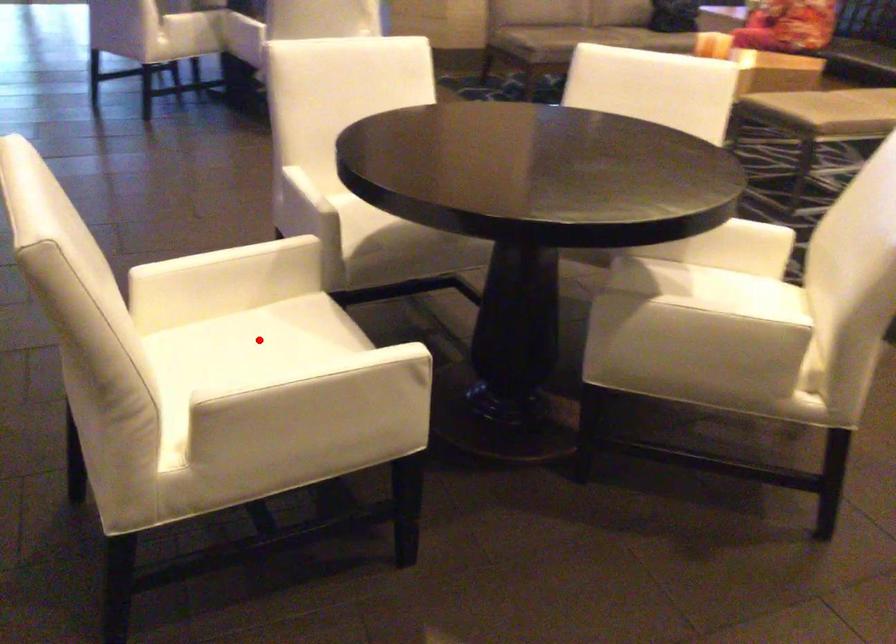
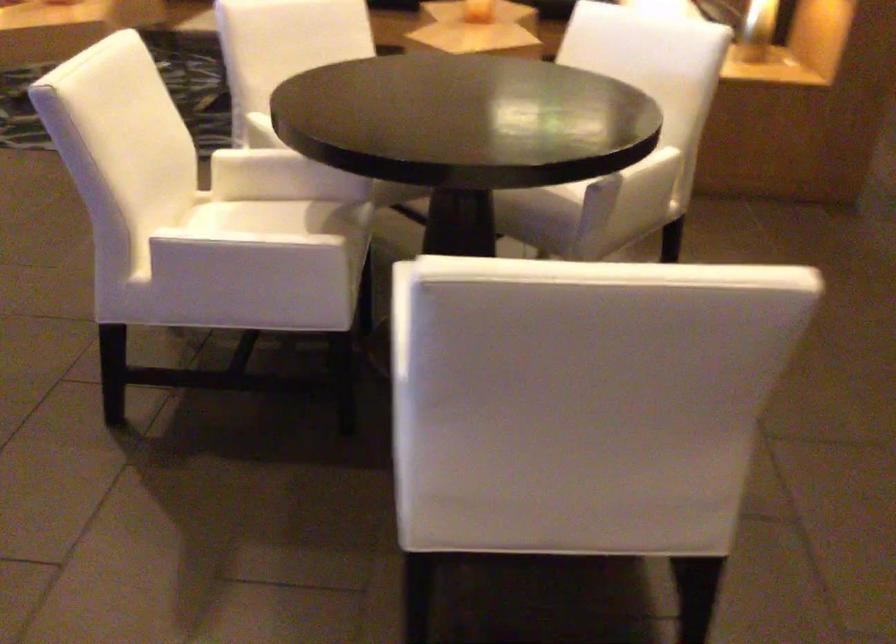
Question: I am providing you with two images of the same scene from different viewpoints. A red point is marked on the first image. At the location where the point appears in image 1, is it still visible in image 2?

Choices:
 (A) Yes
 (B) No

Answer: (B)